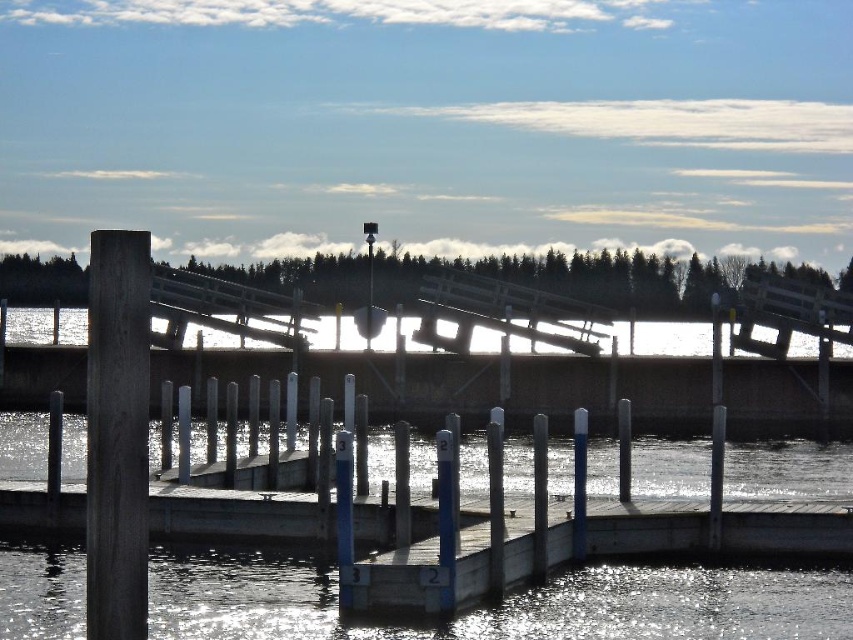
Question: Among these points, which one is nearest to the camera?

Choices:
 (A) pyautogui.click(x=531, y=604)
 (B) pyautogui.click(x=132, y=321)

Answer: (B)

Question: Observing the image, what is the correct spatial positioning of clear water at dock center in reference to dark wood post at left?

Choices:
 (A) above
 (B) below

Answer: (B)

Question: Which point is closer to the camera?

Choices:
 (A) dark wood post at left
 (B) clear water at dock center

Answer: (A)

Question: Can you confirm if clear water at dock center is positioned below dark wood post at left?

Choices:
 (A) no
 (B) yes

Answer: (B)

Question: Is the position of clear water at dock center less distant than that of dark wood post at left?

Choices:
 (A) no
 (B) yes

Answer: (A)